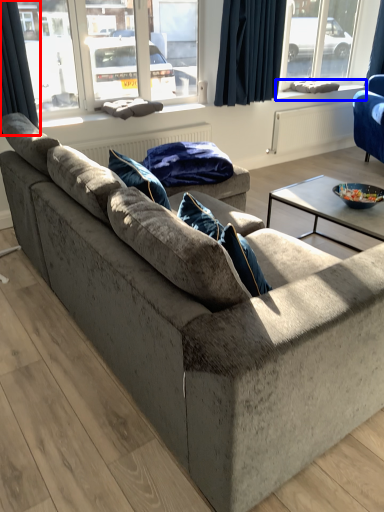
Question: Which of the following is the closest to the observer, curtain (highlighted by a red box) or window sill (highlighted by a blue box)?

Choices:
 (A) curtain
 (B) window sill

Answer: (A)